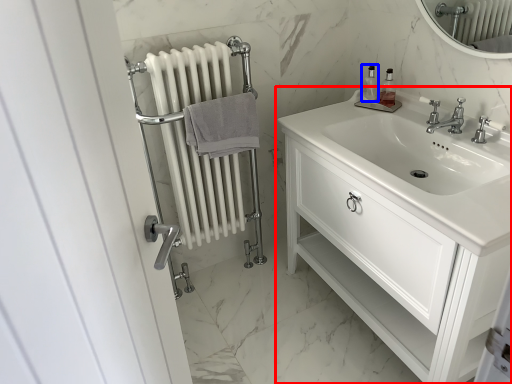
Question: Which of the following is the farthest to the observer, bathroom cabinet (highlighted by a red box) or soap dispenser (highlighted by a blue box)?

Choices:
 (A) bathroom cabinet
 (B) soap dispenser

Answer: (B)